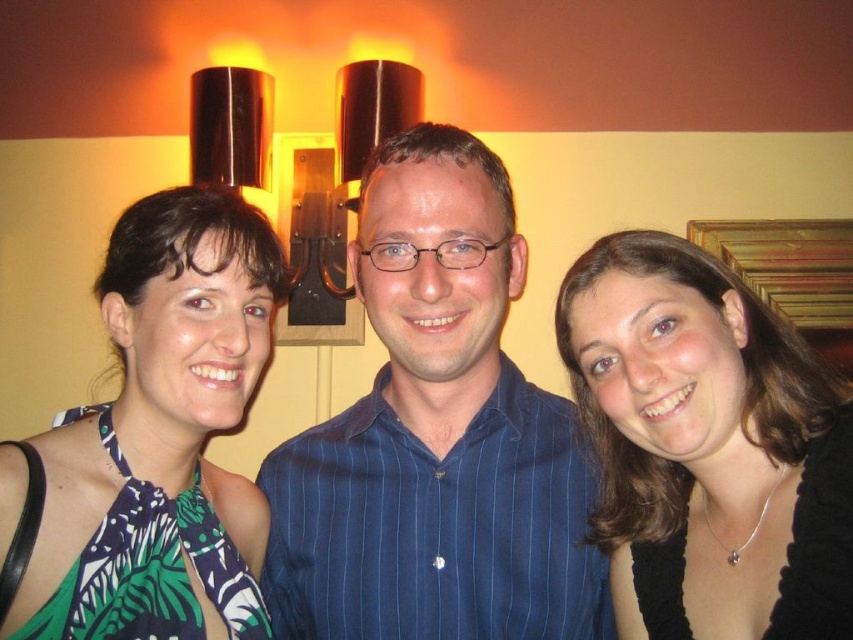
How distant is blue striped shirt at center from green printed dress at center?

blue striped shirt at center is 16.99 centimeters from green printed dress at center.

This screenshot has width=853, height=640. I want to click on blue striped shirt at center, so 436,436.

Between blue striped shirt at center and matte black necklace at right, which one appears on the left side from the viewer's perspective?

blue striped shirt at center is more to the left.

Which is behind, point (434, 168) or point (686, 252)?

The point (686, 252) is behind.

You are a GUI agent. You are given a task and a screenshot of the screen. Output one action in this format:
    pyautogui.click(x=<x>, y=<y>)
    Task: Click on the blue striped shirt at center
    
    Given the screenshot: What is the action you would take?
    pyautogui.click(x=436, y=436)

Is matte black necklace at right smaller than green printed dress at center?

Incorrect, matte black necklace at right is not smaller in size than green printed dress at center.

Is matte black necklace at right positioned behind green printed dress at center?

Yes, matte black necklace at right is further from the viewer.

Is point (693, 301) positioned in front of point (242, 545)?

Yes.

Where is `matte black necklace at right`? matte black necklace at right is located at coordinates (708, 445).